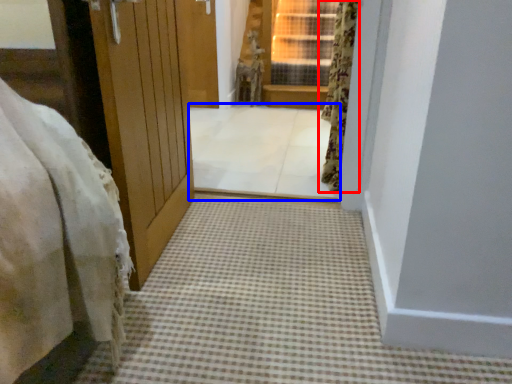
Question: Among these objects, which one is farthest to the camera, curtain (highlighted by a red box) or passage (highlighted by a blue box)?

Choices:
 (A) curtain
 (B) passage

Answer: (B)